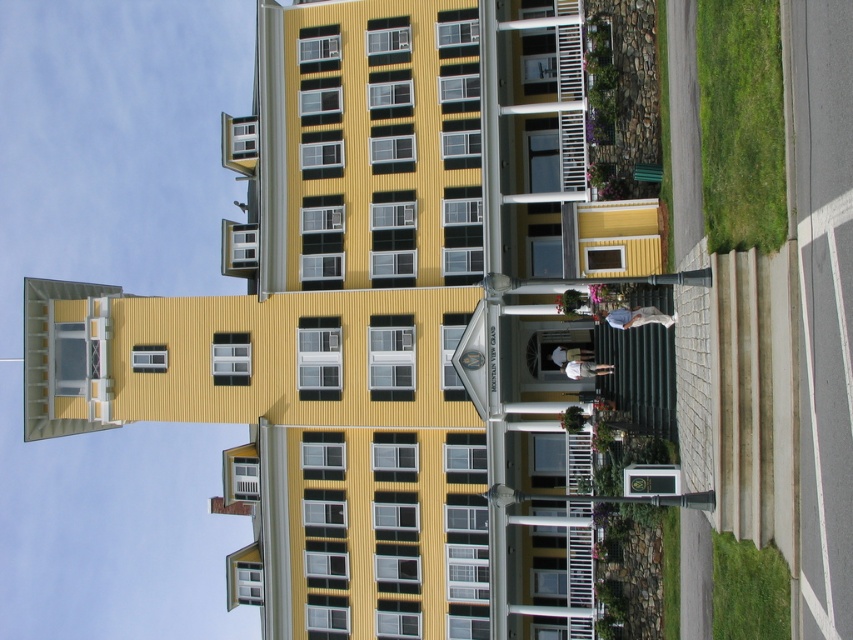
Can you confirm if green grass at right is positioned above green grass at lower right?

Indeed, green grass at right is positioned over green grass at lower right.

Which is more to the right, green grass at right or green grass at lower right?

From the viewer's perspective, green grass at right appears more on the right side.

Measure the distance between point (749,118) and camera.

41.43 meters

What are the coordinates of `green grass at right` in the screenshot? It's located at (741, 124).